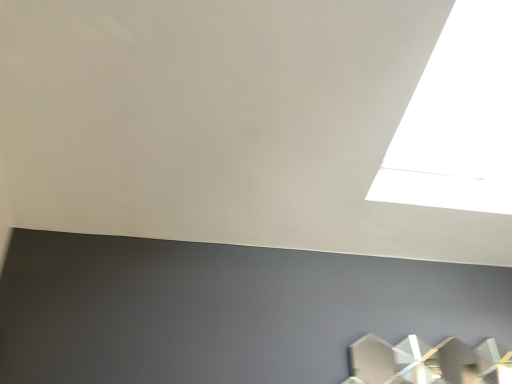
What do you see at coordinates (458, 119) in the screenshot?
I see `transparent glass window at upper right` at bounding box center [458, 119].

Locate an element on the screen. transparent glass window at upper right is located at coordinates (458, 119).

Find the location of a particular element. This screenshot has height=384, width=512. transparent glass window at upper right is located at coordinates (458, 119).